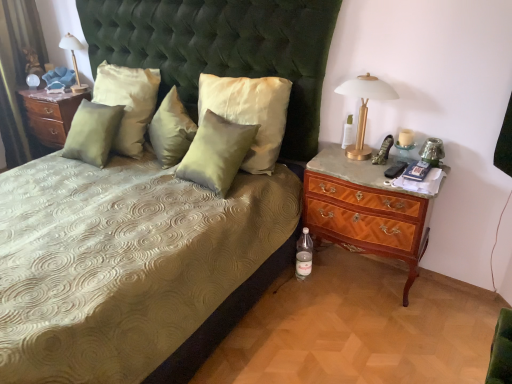
Find the location of a particular element. free spot in front of clear plastic bottle at lower right, the 2th bottle positioned from the top is located at coordinates (305, 300).